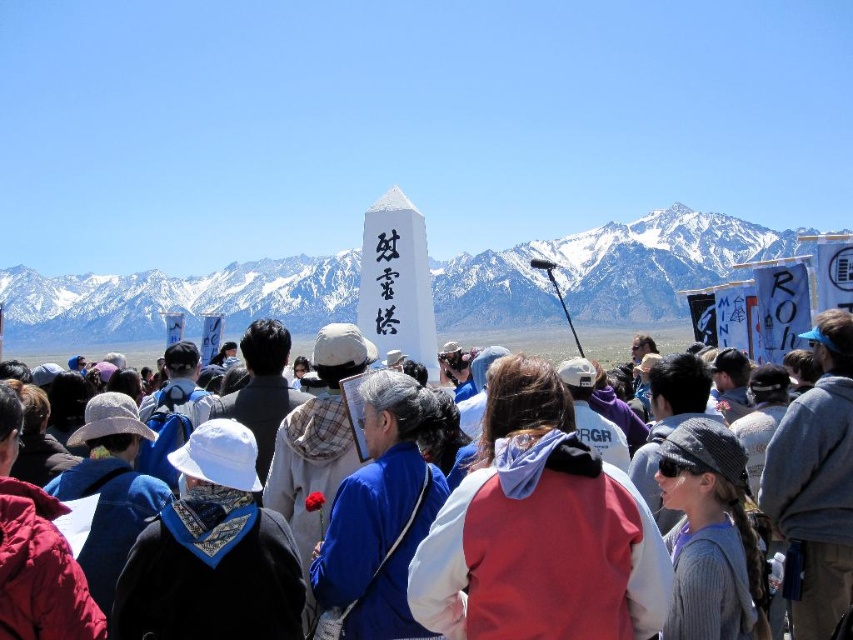
Question: Which object appears closest to the camera in this image?

Choices:
 (A) red hoodie at center
 (B) white snow-covered mountain range at upper center
 (C) white matte monument at center

Answer: (A)

Question: Is the position of white snow-covered mountain range at upper center less distant than that of white matte monument at center?

Choices:
 (A) no
 (B) yes

Answer: (A)

Question: Considering the real-world distances, which object is farthest from the red hoodie at center?

Choices:
 (A) white snow-covered mountain range at upper center
 (B) white matte monument at center

Answer: (A)

Question: Does white snow-covered mountain range at upper center have a larger size compared to red hoodie at center?

Choices:
 (A) no
 (B) yes

Answer: (B)

Question: Does white snow-covered mountain range at upper center have a larger size compared to red hoodie at center?

Choices:
 (A) yes
 (B) no

Answer: (A)

Question: Which point is farther to the camera?

Choices:
 (A) white snow-covered mountain range at upper center
 (B) white matte monument at center
 (C) red hoodie at center

Answer: (A)